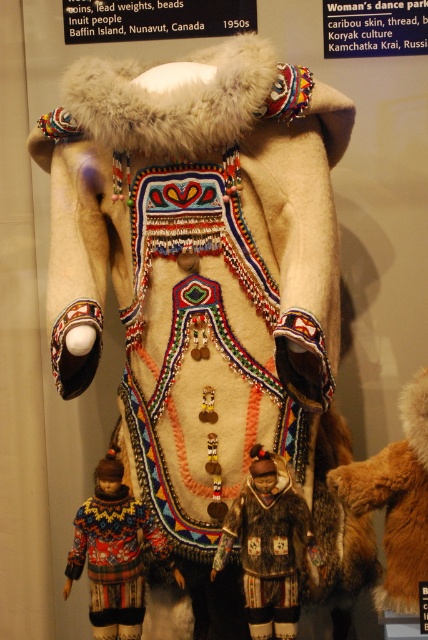
The height and width of the screenshot is (640, 428). What do you see at coordinates (113, 557) in the screenshot?
I see `knitted wool sweater at lower left` at bounding box center [113, 557].

Based on the photo, between knitted wool sweater at lower left and brown fur coat at center, which one has less height?

Standing shorter between the two is brown fur coat at center.

Which is in front, point (130, 500) or point (276, 486)?

Point (276, 486) is in front.

In order to click on knitted wool sweater at lower left in this screenshot , I will do `click(113, 557)`.